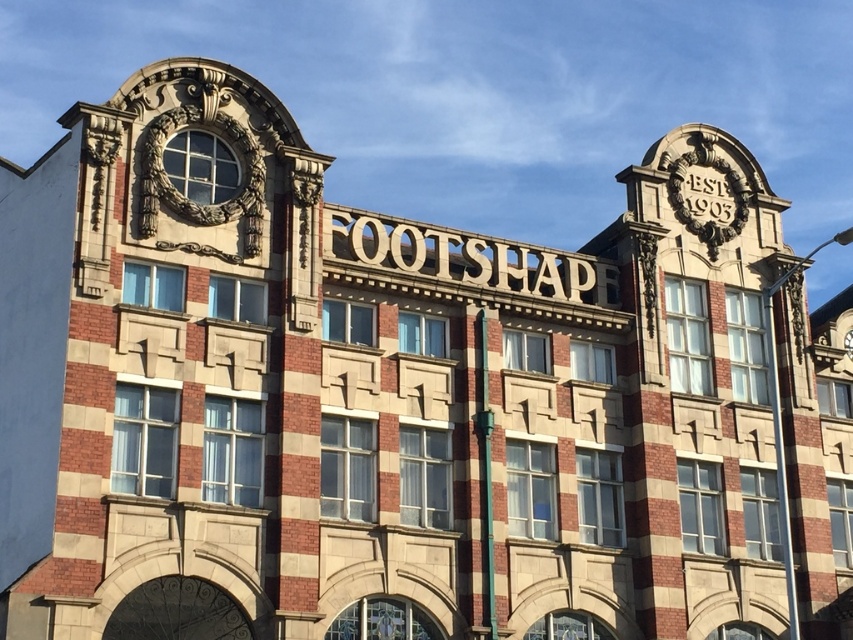
Question: Is gold metallic clock at upper right above gold metallic clock at upper center?

Choices:
 (A) yes
 (B) no

Answer: (A)

Question: Which of the following is the closest to the observer?

Choices:
 (A) gold metallic clock at upper center
 (B) gold metallic clock at upper right

Answer: (B)

Question: Is gold metallic clock at upper right further to camera compared to gold metallic clock at upper center?

Choices:
 (A) no
 (B) yes

Answer: (A)

Question: Which point is farther to the camera?

Choices:
 (A) click(x=846, y=348)
 (B) click(x=689, y=227)

Answer: (A)

Question: Does gold metallic clock at upper right have a smaller size compared to gold metallic clock at upper center?

Choices:
 (A) no
 (B) yes

Answer: (A)